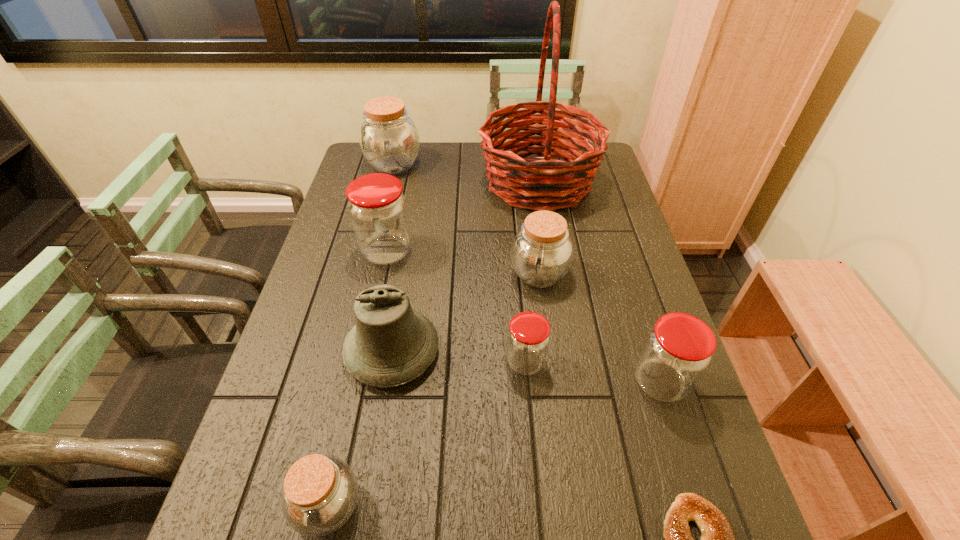
Locate an element on the screen. Image resolution: width=960 pixels, height=540 pixels. unoccupied area between the rightmost brown jar and the farthest red jar is located at coordinates [463, 263].

Locate an element on the screen. vacant space in between the smallest red jar and the rightmost red jar is located at coordinates (592, 372).

Identify which object is the seventh nearest to the farthest jar. Please provide its 2D coordinates. Your answer should be formatted as a tuple, i.e. [(x, y)], where the tuple contains the x and y coordinates of a point satisfying the conditions above.

[(320, 492)]

Find the location of a particular element. object that ranks as the fourth closest to the second red jar from left to right is located at coordinates (717, 539).

Select which jar appears as the fourth closest to the shortest object. Please provide its 2D coordinates. Your answer should be formatted as a tuple, i.e. [(x, y)], where the tuple contains the x and y coordinates of a point satisfying the conditions above.

[(320, 492)]

I want to click on the third closest jar to the rightmost jar, so pyautogui.click(x=320, y=492).

Identify which brown jar is located as the second nearest to the smallest red jar. Please provide its 2D coordinates. Your answer should be formatted as a tuple, i.e. [(x, y)], where the tuple contains the x and y coordinates of a point satisfying the conditions above.

[(320, 492)]

Find the location of `the third closest brown jar to the smallest red jar`. the third closest brown jar to the smallest red jar is located at coordinates (389, 139).

Where is `red jar that is the closest one to the second red jar from right to left`? red jar that is the closest one to the second red jar from right to left is located at coordinates [677, 351].

Identify which red jar is the second closest to the bell. Please provide its 2D coordinates. Your answer should be formatted as a tuple, i.e. [(x, y)], where the tuple contains the x and y coordinates of a point satisfying the conditions above.

[(377, 207)]